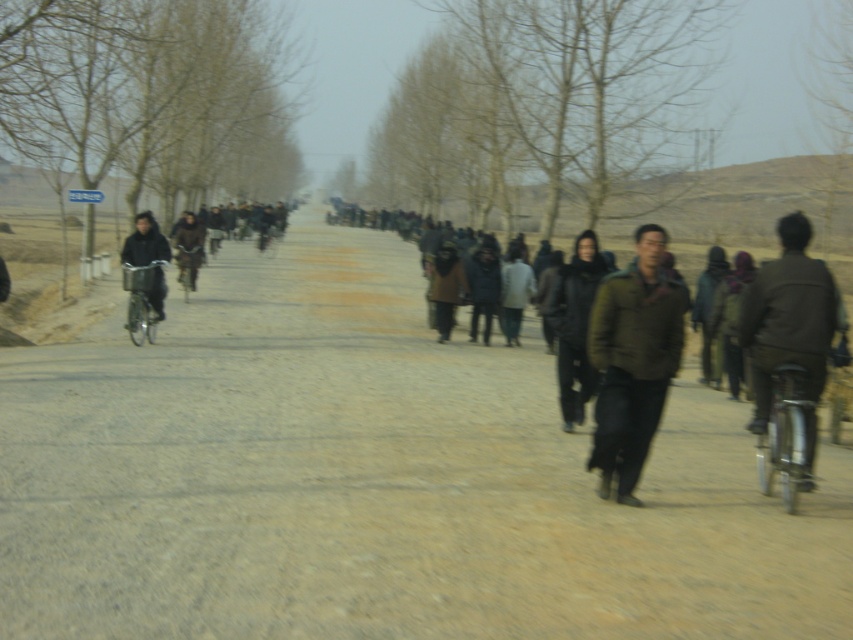
Question: Can you confirm if dark brown leather jacket at center is thinner than brown woolen coat at center?

Choices:
 (A) yes
 (B) no

Answer: (A)

Question: Which is nearer to the dark gray wool coat at center?

Choices:
 (A) dirt road at center
 (B) brown woolen coat at center
 (C) silver metallic bicycle at right
 (D) metallic silver bicycle at left

Answer: (B)

Question: Which object is positioned farthest from the dark gray wool coat at center?

Choices:
 (A) metallic silver bicycle at left
 (B) green matte jacket at center
 (C) brown woolen coat at center
 (D) dirt road at center

Answer: (B)

Question: Is dark brown leather jacket at center wider than metallic silver bicycle at left?

Choices:
 (A) yes
 (B) no

Answer: (B)

Question: Observing the image, what is the correct spatial positioning of green matte jacket at center in reference to dark brown leather jacket at center?

Choices:
 (A) left
 (B) right

Answer: (B)

Question: Which object is positioned closest to the green matte jacket at center?

Choices:
 (A) metallic silver bicycle at left
 (B) dirt road at center

Answer: (B)